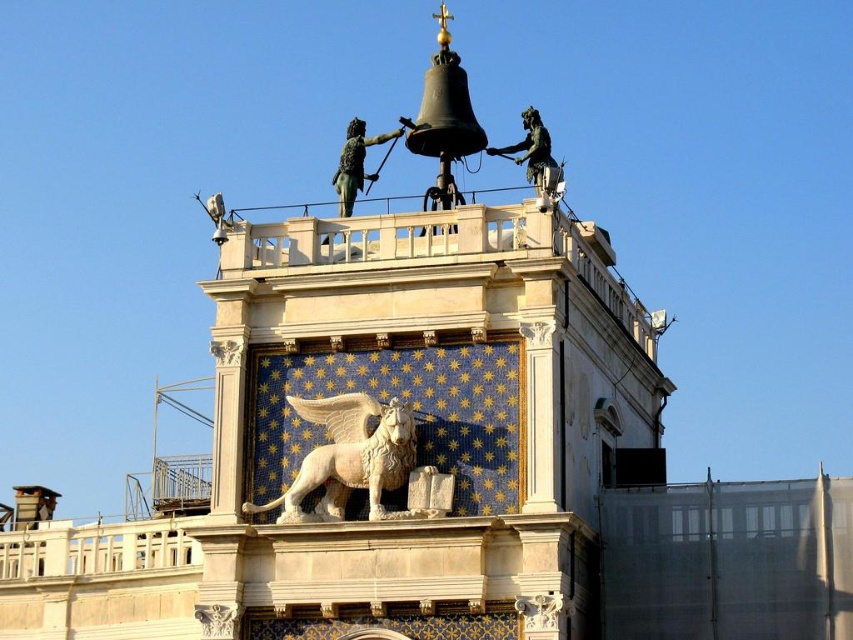
You are an architect examining the historic building. You notice the white marble tower at center and the white marble lion at center. Which one is located higher up in the image?

The white marble tower at center is positioned over the white marble lion at center, so it is higher up.

Looking at the historic building with its ornate facade, you notice the white marble lion at center and the green polished bronze statue at upper center. Which of these two objects is positioned to the right of the other?

The white marble lion at center is to the right of the green polished bronze statue at upper center.